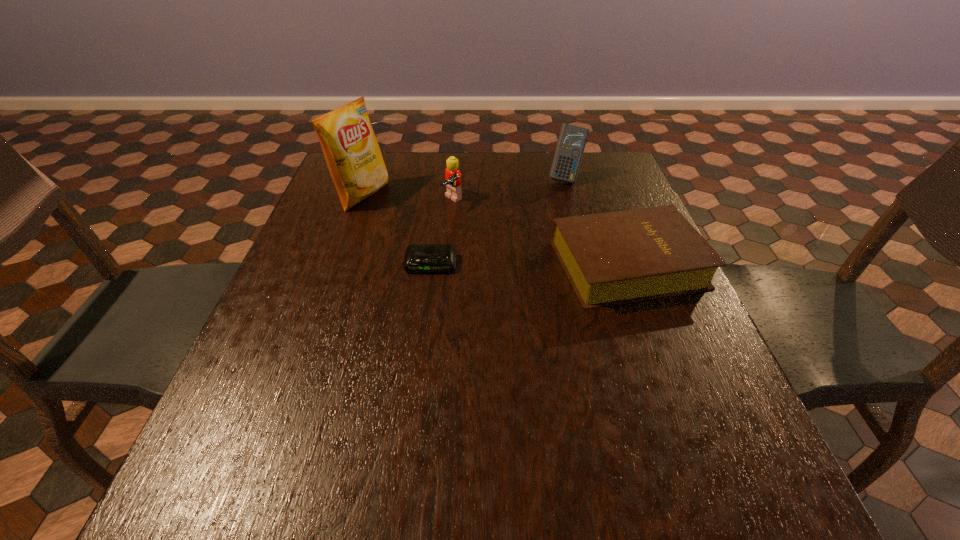
What are the coordinates of `vacant area that lies between the alarm clock and the fourth shortest object` in the screenshot? It's located at (498, 221).

Identify the location of object that is the second nearest to the second shortest object. (419, 258).

Select which object is the second closest to the third tallest object. Please provide its 2D coordinates. Your answer should be formatted as a tuple, i.e. [(x, y)], where the tuple contains the x and y coordinates of a point satisfying the conditions above.

[(419, 258)]

This screenshot has width=960, height=540. Find the location of `vacant area in the image that satisfies the following two spatial constraints: 1. on the display of the fourth tallest object; 2. on the left side of the shortest object`. vacant area in the image that satisfies the following two spatial constraints: 1. on the display of the fourth tallest object; 2. on the left side of the shortest object is located at coordinates (431, 265).